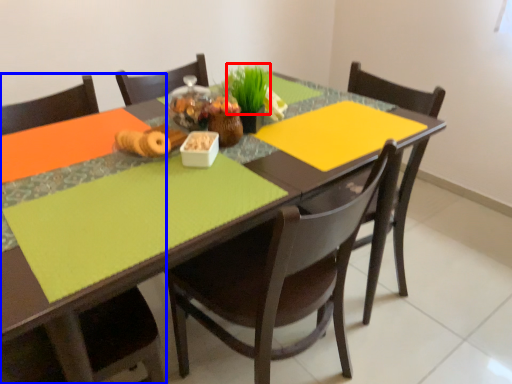
Question: Which point is further to the camera, grass (highlighted by a red box) or chair (highlighted by a blue box)?

Choices:
 (A) grass
 (B) chair

Answer: (A)